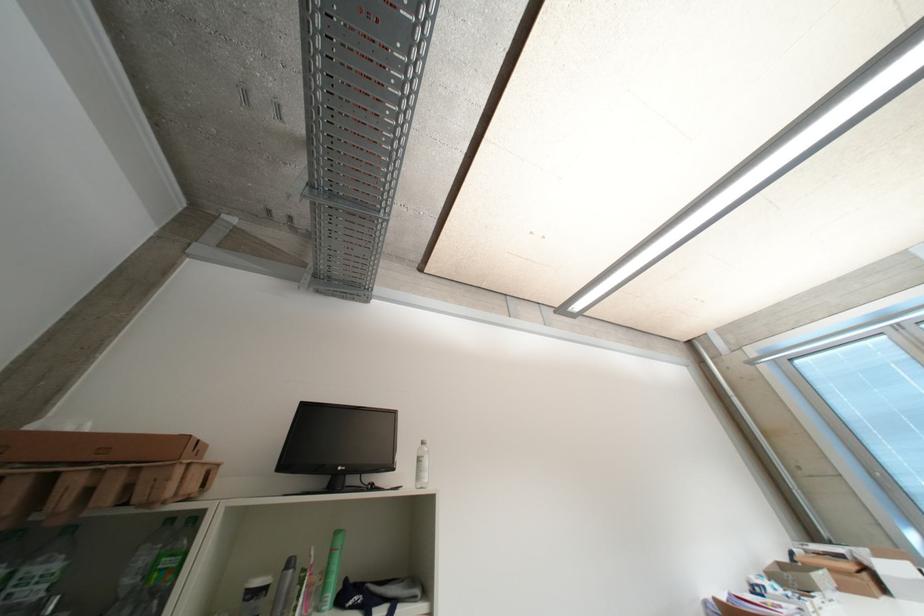
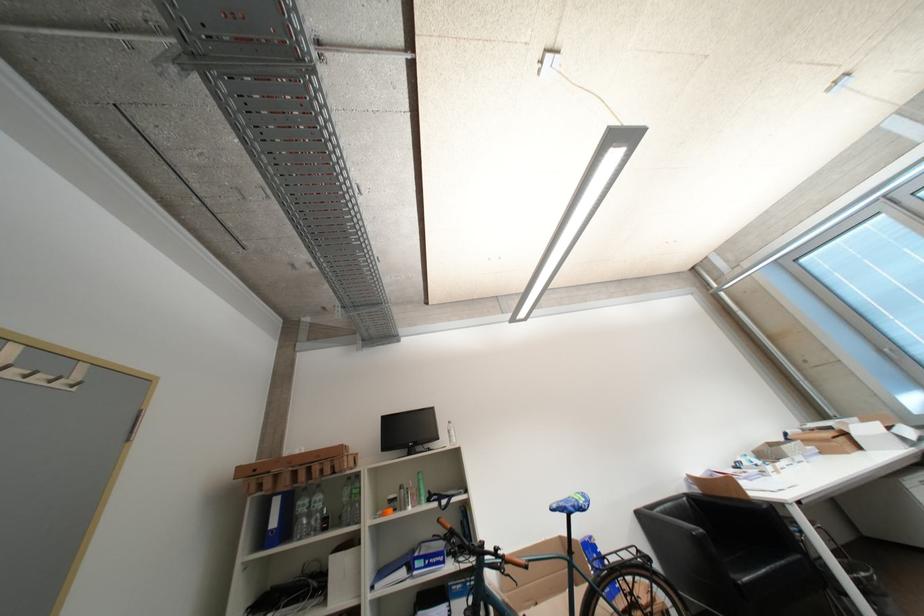
The images are taken continuously from a first-person perspective. In which direction are you moving?

The movement direction of the cameraman is right, backward.